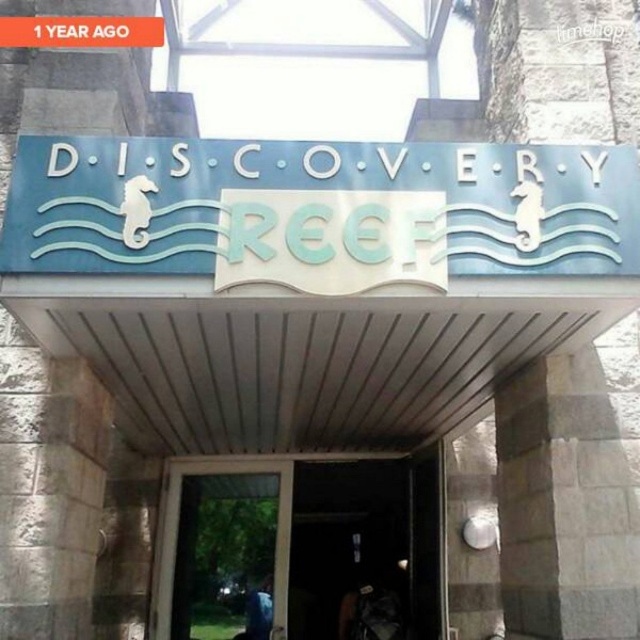
Question: Which object is positioned closest to the blue matte sign at upper center?

Choices:
 (A) transparent glass door at center
 (B) blue metallic sign at upper center

Answer: (B)

Question: Which object appears farthest from the camera in this image?

Choices:
 (A) blue matte sign at upper center
 (B) blue metallic sign at upper center

Answer: (B)

Question: Is transparent glass door at center above blue metallic sign at upper center?

Choices:
 (A) no
 (B) yes

Answer: (A)

Question: Which point is farther to the camera?

Choices:
 (A) blue matte sign at upper center
 (B) transparent glass door at center

Answer: (B)

Question: Is blue matte sign at upper center below blue metallic sign at upper center?

Choices:
 (A) no
 (B) yes

Answer: (B)

Question: Is blue matte sign at upper center below blue metallic sign at upper center?

Choices:
 (A) yes
 (B) no

Answer: (A)